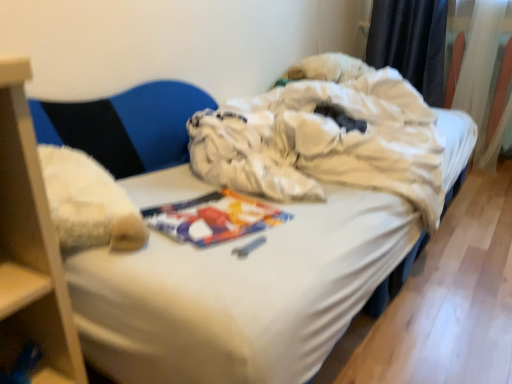
This screenshot has height=384, width=512. What do you see at coordinates (277, 235) in the screenshot?
I see `white fabric bed at center` at bounding box center [277, 235].

At what (x,y) coordinates should I click in order to perform the action: click on fuzzy fabric armchair at left. Please return your answer as a coordinate pair (x, y). This screenshot has width=512, height=384. Looking at the image, I should click on (126, 126).

Is fuzzy fabric armchair at left aimed at white sheer curtain at upper right, the 2th curtain in the left-to-right sequence?

No.

Is white sheer curtain at upper right, which is the 1th curtain from right to left, completely or partially inside fuzzy fabric armchair at left?

Actually, white sheer curtain at upper right, which is the 1th curtain from right to left, is outside fuzzy fabric armchair at left.

Is fuzzy fabric armchair at left next to white sheer curtain at upper right, which is the 1th curtain from right to left?

No, fuzzy fabric armchair at left is not next to white sheer curtain at upper right, which is the 1th curtain from right to left.

Considering the relative sizes of fuzzy fabric armchair at left and white sheer curtain at upper right, which is the 1th curtain from right to left, in the image provided, is fuzzy fabric armchair at left wider than white sheer curtain at upper right, which is the 1th curtain from right to left,?

In fact, fuzzy fabric armchair at left might be narrower than white sheer curtain at upper right, which is the 1th curtain from right to left.

Considering the relative sizes of fuzzy fabric armchair at left and black fabric curtain at upper right, which is counted as the second curtain, starting from the right, in the image provided, is fuzzy fabric armchair at left smaller than black fabric curtain at upper right, which is counted as the second curtain, starting from the right,?

Actually, fuzzy fabric armchair at left might be larger than black fabric curtain at upper right, which is counted as the second curtain, starting from the right.

Identify the location of the 1st curtain counting from the right of the fuzzy fabric armchair at left. (411, 43).

Can you tell me how much fuzzy fabric armchair at left and black fabric curtain at upper right, marked as the first curtain in a left-to-right arrangement, differ in facing direction?

fuzzy fabric armchair at left and black fabric curtain at upper right, marked as the first curtain in a left-to-right arrangement, are facing 67.6 degrees away from each other.

Looking at this image, does fuzzy fabric armchair at left turn towards black fabric curtain at upper right, which is counted as the second curtain, starting from the right?

No, fuzzy fabric armchair at left is not turned towards black fabric curtain at upper right, which is counted as the second curtain, starting from the right.

How much distance is there between black fabric curtain at upper right, which is counted as the second curtain, starting from the right, and fuzzy fabric armchair at left?

black fabric curtain at upper right, which is counted as the second curtain, starting from the right, is 1.43 meters away from fuzzy fabric armchair at left.

Would you say black fabric curtain at upper right, marked as the first curtain in a left-to-right arrangement, is outside fuzzy fabric armchair at left?

Yes, black fabric curtain at upper right, marked as the first curtain in a left-to-right arrangement, is not within fuzzy fabric armchair at left.

Can you tell me how much black fabric curtain at upper right, marked as the first curtain in a left-to-right arrangement, and fuzzy fabric armchair at left differ in facing direction?

They differ by 67.6 degrees in their facing directions.

Is black fabric curtain at upper right, marked as the first curtain in a left-to-right arrangement, aimed at fuzzy fabric armchair at left?

No, black fabric curtain at upper right, marked as the first curtain in a left-to-right arrangement, is not oriented towards fuzzy fabric armchair at left.

Is black fabric curtain at upper right, marked as the first curtain in a left-to-right arrangement, oriented away from white fabric bed at center?

That's not correct — black fabric curtain at upper right, marked as the first curtain in a left-to-right arrangement, is not looking away from white fabric bed at center.

Considering the relative positions of black fabric curtain at upper right, marked as the first curtain in a left-to-right arrangement, and white fabric bed at center in the image provided, is black fabric curtain at upper right, marked as the first curtain in a left-to-right arrangement, in front of white fabric bed at center?

No.

From a real-world perspective, who is located lower, black fabric curtain at upper right, marked as the first curtain in a left-to-right arrangement, or white fabric bed at center?

white fabric bed at center.

Consider the image. Considering the relative positions of white sheer curtain at upper right, which is the 1th curtain from right to left, and fuzzy fabric armchair at left in the image provided, is white sheer curtain at upper right, which is the 1th curtain from right to left, behind fuzzy fabric armchair at left?

Yes, white sheer curtain at upper right, which is the 1th curtain from right to left, is further from the viewer.

Is point (475, 23) positioned behind point (200, 92)?

Yes.

Is white sheer curtain at upper right, which is the 1th curtain from right to left, to the left or to the right of fuzzy fabric armchair at left in the image?

white sheer curtain at upper right, which is the 1th curtain from right to left, is to the right of fuzzy fabric armchair at left.

The width and height of the screenshot is (512, 384). What are the coordinates of `curtain that is the 1st object located above the fuzzy fabric armchair at left (from the image's perspective)` in the screenshot? It's located at (482, 78).

Is white fabric bed at center touching white sheer curtain at upper right, which is the 1th curtain from right to left?

white fabric bed at center is not next to white sheer curtain at upper right, which is the 1th curtain from right to left, and they're not touching.

Can you confirm if white fabric bed at center is smaller than white sheer curtain at upper right, the 2th curtain in the left-to-right sequence?

Actually, white fabric bed at center might be larger than white sheer curtain at upper right, the 2th curtain in the left-to-right sequence.

Is white fabric bed at center at the right side of white sheer curtain at upper right, which is the 1th curtain from right to left?

No, white fabric bed at center is not to the right of white sheer curtain at upper right, which is the 1th curtain from right to left.

Image resolution: width=512 pixels, height=384 pixels. What are the coordinates of `bed in front of the white sheer curtain at upper right, which is the 1th curtain from right to left` in the screenshot? It's located at (277, 235).

From the image's perspective, is white fabric bed at center located above or below fuzzy fabric armchair at left?

From the image's perspective, white fabric bed at center appears below fuzzy fabric armchair at left.

Which of these two, white fabric bed at center or fuzzy fabric armchair at left, is thinner?

With smaller width is fuzzy fabric armchair at left.

Is white fabric bed at center facing away from fuzzy fabric armchair at left?

white fabric bed at center does not have its back to fuzzy fabric armchair at left.

Is white fabric bed at center not close to fuzzy fabric armchair at left?

That's not correct — white fabric bed at center is a little close to fuzzy fabric armchair at left.

What are the coordinates of `the 1st curtain behind the fuzzy fabric armchair at left` in the screenshot? It's located at click(x=482, y=78).

Locate an element on the screen. The height and width of the screenshot is (384, 512). the 2nd curtain positioned above the fuzzy fabric armchair at left (from the image's perspective) is located at coordinates (411, 43).

Looking at this image, when comparing their distances from white fabric bed at center, does black fabric curtain at upper right, marked as the first curtain in a left-to-right arrangement, or fuzzy fabric armchair at left seem closer?

Among the two, fuzzy fabric armchair at left is located nearer to white fabric bed at center.

Considering their positions, is white fabric bed at center positioned closer to white sheer curtain at upper right, the 2th curtain in the left-to-right sequence, than fuzzy fabric armchair at left?

Based on the image, white fabric bed at center appears to be nearer to white sheer curtain at upper right, the 2th curtain in the left-to-right sequence.

Which object lies further to the anchor point fuzzy fabric armchair at left, white sheer curtain at upper right, the 2th curtain in the left-to-right sequence, or black fabric curtain at upper right, marked as the first curtain in a left-to-right arrangement?

white sheer curtain at upper right, the 2th curtain in the left-to-right sequence, is further to fuzzy fabric armchair at left.

From the image, which object appears to be farther from white sheer curtain at upper right, which is the 1th curtain from right to left, fuzzy fabric armchair at left or black fabric curtain at upper right, marked as the first curtain in a left-to-right arrangement?

The object further to white sheer curtain at upper right, which is the 1th curtain from right to left, is fuzzy fabric armchair at left.

From the image, which object appears to be farther from fuzzy fabric armchair at left, white sheer curtain at upper right, which is the 1th curtain from right to left, or white fabric bed at center?

white sheer curtain at upper right, which is the 1th curtain from right to left, lies further to fuzzy fabric armchair at left than the other object.

Considering their positions, is white sheer curtain at upper right, which is the 1th curtain from right to left, positioned closer to black fabric curtain at upper right, marked as the first curtain in a left-to-right arrangement, than fuzzy fabric armchair at left?

white sheer curtain at upper right, which is the 1th curtain from right to left, lies closer to black fabric curtain at upper right, marked as the first curtain in a left-to-right arrangement, than the other object.

Considering their positions, is white sheer curtain at upper right, the 2th curtain in the left-to-right sequence, positioned further to black fabric curtain at upper right, which is counted as the second curtain, starting from the right, than white fabric bed at center?

white fabric bed at center is further to black fabric curtain at upper right, which is counted as the second curtain, starting from the right.

Estimate the real-world distances between objects in this image. Which object is closer to black fabric curtain at upper right, which is counted as the second curtain, starting from the right, white fabric bed at center or white sheer curtain at upper right, which is the 1th curtain from right to left?

white sheer curtain at upper right, which is the 1th curtain from right to left, is closer to black fabric curtain at upper right, which is counted as the second curtain, starting from the right.

Image resolution: width=512 pixels, height=384 pixels. Find the location of `armchair located between white fabric bed at center and black fabric curtain at upper right, marked as the first curtain in a left-to-right arrangement, in the depth direction`. armchair located between white fabric bed at center and black fabric curtain at upper right, marked as the first curtain in a left-to-right arrangement, in the depth direction is located at coordinates (126, 126).

At what (x,y) coordinates should I click in order to perform the action: click on curtain between fuzzy fabric armchair at left and white sheer curtain at upper right, which is the 1th curtain from right to left, from left to right. Please return your answer as a coordinate pair (x, y). The width and height of the screenshot is (512, 384). Looking at the image, I should click on (411, 43).

The image size is (512, 384). Identify the location of bed between fuzzy fabric armchair at left and white sheer curtain at upper right, which is the 1th curtain from right to left. (277, 235).

This screenshot has height=384, width=512. I want to click on curtain located between white fabric bed at center and black fabric curtain at upper right, marked as the first curtain in a left-to-right arrangement, in the depth direction, so click(482, 78).